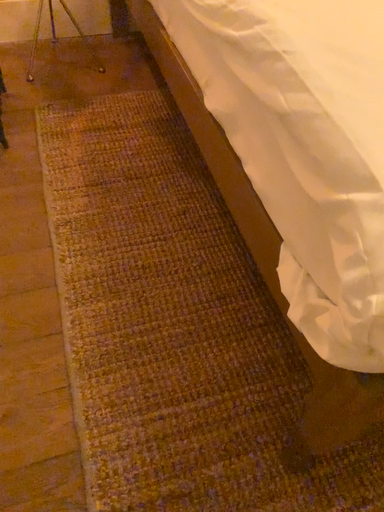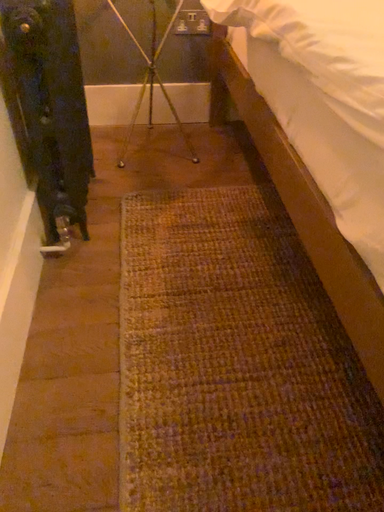
Question: How did the camera likely rotate when shooting the video?

Choices:
 (A) rotated left
 (B) rotated right

Answer: (A)